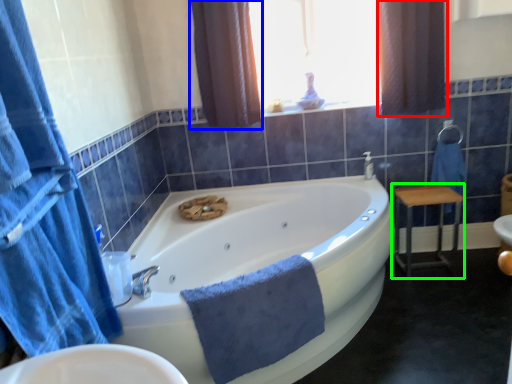
Question: Which object is positioned closest to curtain (highlighted by a red box)? Select from curtain (highlighted by a blue box) and furniture (highlighted by a green box).

Choices:
 (A) curtain
 (B) furniture

Answer: (B)